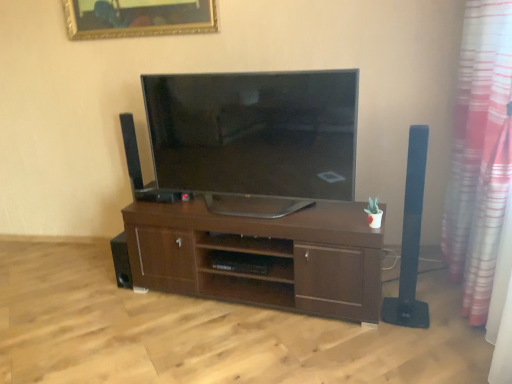
Identify the location of space that is in front of black matte speaker at lower left, positioned as the second speaker in back-to-front order. (124, 299).